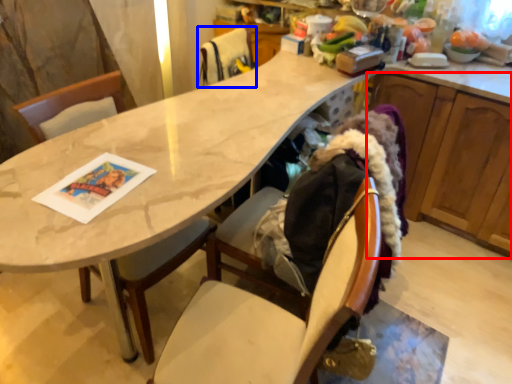
Question: Which object is closer to the camera taking this photo, cabinetry (highlighted by a red box) or chair (highlighted by a blue box)?

Choices:
 (A) cabinetry
 (B) chair

Answer: (A)